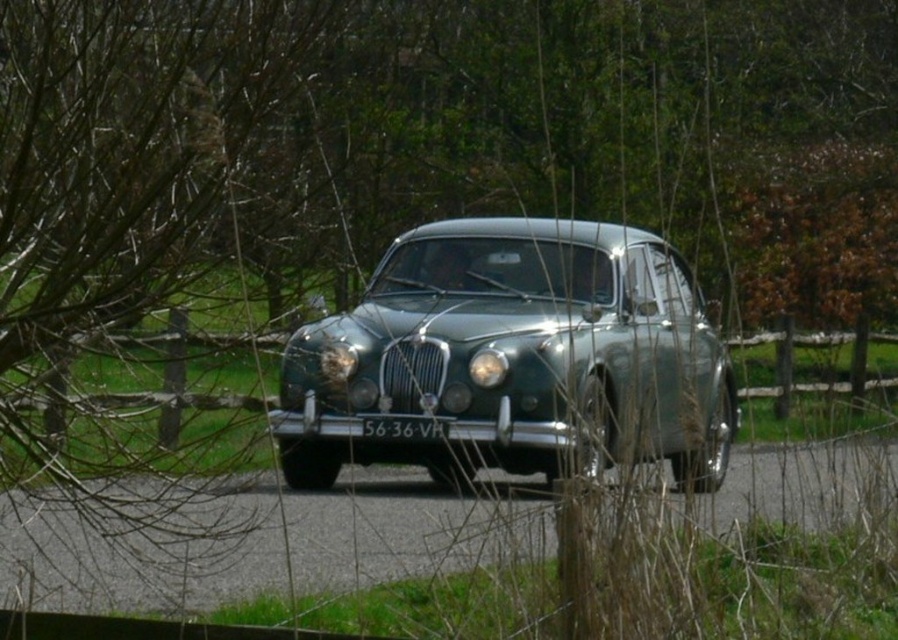
Can you confirm if metallic green car at center is bigger than matte silver headlight at center?

Correct, metallic green car at center is larger in size than matte silver headlight at center.

Is point (298, 339) closer to viewer compared to point (474, 385)?

Yes, it is.

Where is `metallic green car at center`? metallic green car at center is located at coordinates (513, 356).

Describe the element at coordinates (403, 428) in the screenshot. The width and height of the screenshot is (898, 640). I see `white plastic license plate at center` at that location.

Is white plastic license plate at center shorter than matte silver headlight at center?

Yes.

Image resolution: width=898 pixels, height=640 pixels. What are the coordinates of `white plastic license plate at center` in the screenshot? It's located at (403, 428).

The height and width of the screenshot is (640, 898). I want to click on white plastic license plate at center, so click(403, 428).

Which of these two, metallic green car at center or white plastic license plate at center, stands taller?

With more height is metallic green car at center.

Where is `metallic green car at center`? The width and height of the screenshot is (898, 640). metallic green car at center is located at coordinates (513, 356).

What do you see at coordinates (513, 356) in the screenshot? I see `metallic green car at center` at bounding box center [513, 356].

Where is `metallic green car at center`? metallic green car at center is located at coordinates (513, 356).